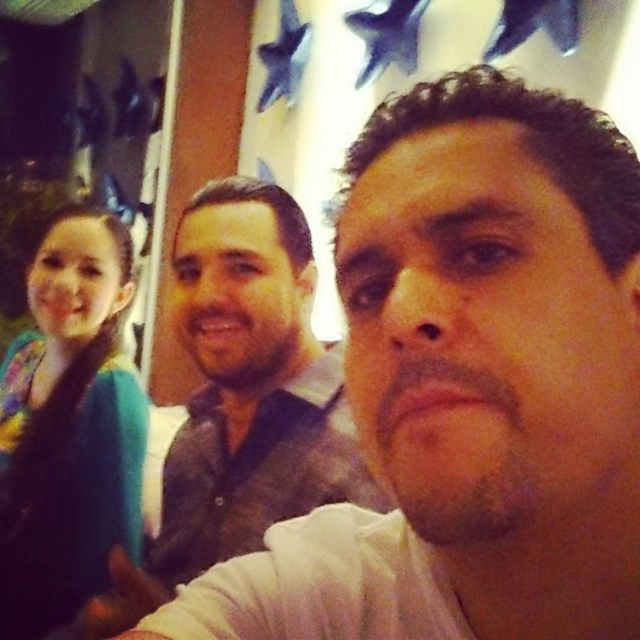
Is white matte shirt at center closer to camera compared to teal fabric shirt at left?

That is True.

Is point (244, 456) closer to camera compared to point (92, 356)?

Yes, it is in front of point (92, 356).

In order to click on white matte shirt at center in this screenshot , I will do `click(250, 385)`.

At what (x,y) coordinates should I click in order to perform the action: click on white matte shirt at center. Please return your answer as a coordinate pair (x, y). The image size is (640, 640). Looking at the image, I should click on (250, 385).